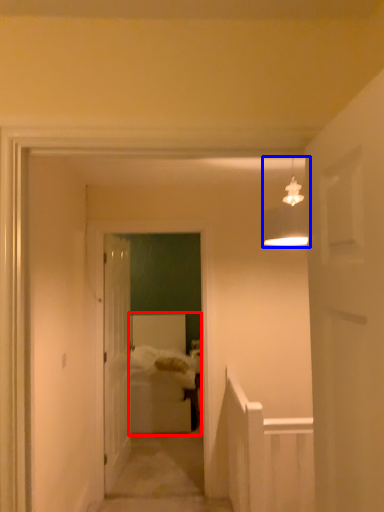
Question: Which object is further to the camera taking this photo, bed (highlighted by a red box) or light fixture (highlighted by a blue box)?

Choices:
 (A) bed
 (B) light fixture

Answer: (A)